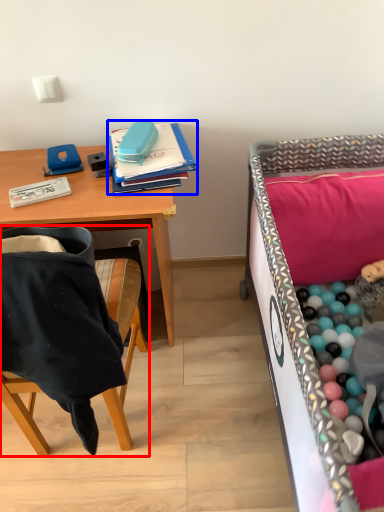
Question: Which object is further to the camera taking this photo, chair (highlighted by a red box) or notebook (highlighted by a blue box)?

Choices:
 (A) chair
 (B) notebook

Answer: (B)